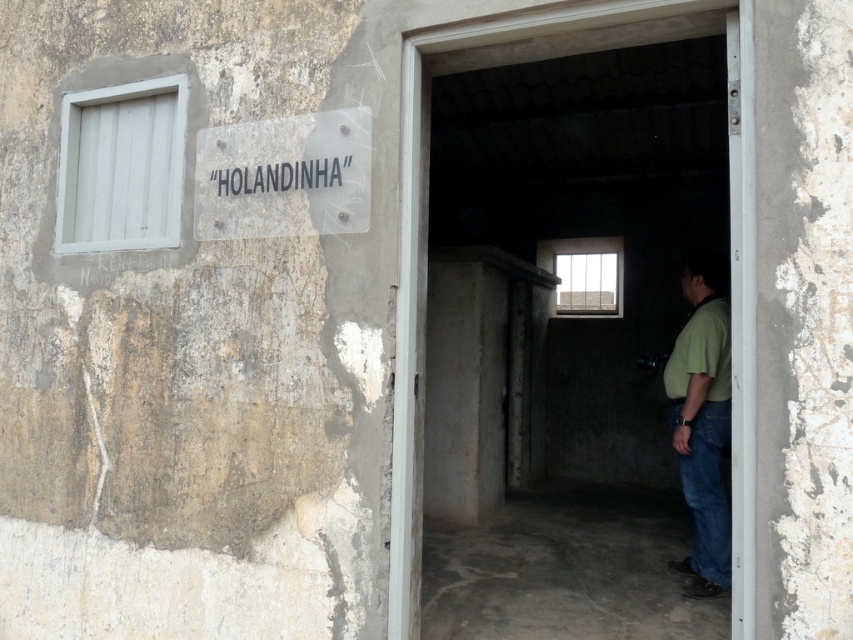
Question: Among these points, which one is nearest to the camera?

Choices:
 (A) (316, 179)
 (B) (695, 580)
 (C) (474, 29)

Answer: (C)

Question: Which of these objects is positioned farthest from the green matte shirt at center?

Choices:
 (A) concrete door frame at center
 (B) transparent plastic sign at upper left

Answer: (B)

Question: Is concrete door frame at center bigger than transparent plastic sign at upper left?

Choices:
 (A) yes
 (B) no

Answer: (A)

Question: Is concrete door frame at center bigger than green matte shirt at center?

Choices:
 (A) yes
 (B) no

Answer: (A)

Question: Which object appears closest to the camera in this image?

Choices:
 (A) green matte shirt at center
 (B) concrete door frame at center
 (C) transparent plastic sign at upper left

Answer: (B)

Question: Is concrete door frame at center to the left of green matte shirt at center from the viewer's perspective?

Choices:
 (A) no
 (B) yes

Answer: (B)